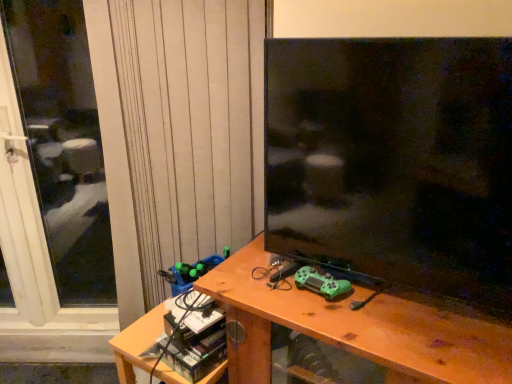
Question: Can you confirm if wooden desk at center is thinner than transparent glass screen door at left?

Choices:
 (A) no
 (B) yes

Answer: (A)

Question: From a real-world perspective, is wooden desk at center beneath transparent glass screen door at left?

Choices:
 (A) yes
 (B) no

Answer: (A)

Question: Is wooden desk at center taller than transparent glass screen door at left?

Choices:
 (A) yes
 (B) no

Answer: (B)

Question: Can you confirm if wooden desk at center is shorter than transparent glass screen door at left?

Choices:
 (A) no
 (B) yes

Answer: (B)

Question: Can you confirm if wooden desk at center is bigger than transparent glass screen door at left?

Choices:
 (A) yes
 (B) no

Answer: (A)

Question: From a real-world perspective, relative to wooden desk at center, is green matte game controller at center, which is the first toy from right to left, vertically above or below?

Choices:
 (A) below
 (B) above

Answer: (B)

Question: Does point (321, 291) appear closer or farther from the camera than point (424, 347)?

Choices:
 (A) closer
 (B) farther

Answer: (B)

Question: From the image's perspective, is green matte game controller at center, which appears as the 1th toy when viewed from the front, above or below wooden desk at center?

Choices:
 (A) above
 (B) below

Answer: (A)

Question: Based on their positions, is green matte game controller at center, positioned as the 2th toy in back-to-front order, located to the left or right of wooden desk at center?

Choices:
 (A) left
 (B) right

Answer: (A)

Question: In terms of height, does green matte game controller at center, positioned as the 2th toy in back-to-front order, look taller or shorter compared to green plastic toy at lower left, the 2th toy when ordered from front to back?

Choices:
 (A) tall
 (B) short

Answer: (B)

Question: From a real-world perspective, is green matte game controller at center, which is the first toy from right to left, above or below green plastic toy at lower left, the 2th toy when ordered from front to back?

Choices:
 (A) below
 (B) above

Answer: (B)

Question: Is green matte game controller at center, positioned as the 2th toy in back-to-front order, in front of or behind green plastic toy at lower left, arranged as the first toy when viewed from the back, in the image?

Choices:
 (A) front
 (B) behind

Answer: (A)

Question: From the image's perspective, relative to green plastic toy at lower left, the 2th toy when ordered from front to back, is green matte game controller at center, positioned as the 2th toy in back-to-front order, above or below?

Choices:
 (A) below
 (B) above

Answer: (B)

Question: From the image's perspective, relative to transparent glass screen door at left, is wooden desk at center above or below?

Choices:
 (A) above
 (B) below

Answer: (B)

Question: In terms of size, does wooden desk at center appear bigger or smaller than transparent glass screen door at left?

Choices:
 (A) big
 (B) small

Answer: (A)